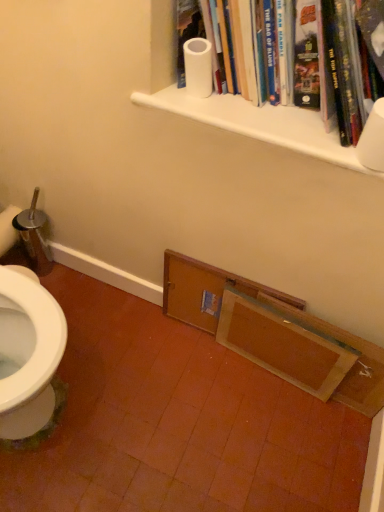
Question: From the image's perspective, is white matte shelf at upper center, placed as the first shelf when sorted from top to bottom, above white matte toilet paper at upper right, which is the second toilet paper in top-to-bottom order?

Choices:
 (A) yes
 (B) no

Answer: (A)

Question: From a real-world perspective, is white matte shelf at upper center, placed as the first shelf when sorted from top to bottom, on white matte toilet paper at upper right, which ranks as the 1th toilet paper in right-to-left order?

Choices:
 (A) no
 (B) yes

Answer: (A)

Question: Is the depth of white matte shelf at upper center, which is counted as the first shelf, starting from the front, greater than that of white matte toilet paper at upper right, the 2th toilet paper positioned from the back?

Choices:
 (A) yes
 (B) no

Answer: (A)

Question: Is white matte shelf at upper center, which is counted as the 2th shelf, starting from the back, taller than white matte toilet paper at upper right, which ranks as the second toilet paper in left-to-right order?

Choices:
 (A) yes
 (B) no

Answer: (B)

Question: From the image's perspective, would you say white matte shelf at upper center, arranged as the second shelf when ordered from the bottom, is shown under white matte toilet paper at upper right, the first toilet paper when ordered from bottom to top?

Choices:
 (A) no
 (B) yes

Answer: (A)

Question: From a real-world perspective, is wooden door at lower center, acting as the second shelf starting from the top, above or below white matte shelf at upper center, which is counted as the 2th shelf, starting from the back?

Choices:
 (A) above
 (B) below

Answer: (B)

Question: Considering the positions of wooden door at lower center, acting as the second shelf starting from the top, and white matte shelf at upper center, which is counted as the first shelf, starting from the front, in the image, is wooden door at lower center, acting as the second shelf starting from the top, bigger or smaller than white matte shelf at upper center, which is counted as the first shelf, starting from the front,?

Choices:
 (A) big
 (B) small

Answer: (A)

Question: From the image's perspective, relative to white matte shelf at upper center, which is counted as the 2th shelf, starting from the back, is wooden door at lower center, acting as the second shelf starting from the top, above or below?

Choices:
 (A) below
 (B) above

Answer: (A)

Question: Does point (208, 314) appear closer or farther from the camera than point (342, 157)?

Choices:
 (A) farther
 (B) closer

Answer: (A)

Question: Is white matte toilet paper at upper center, which is the 1th toilet paper in top-to-bottom order, bigger or smaller than white matte toilet paper at upper right, which ranks as the 1th toilet paper in right-to-left order?

Choices:
 (A) big
 (B) small

Answer: (B)

Question: Relative to white matte toilet paper at upper right, which ranks as the second toilet paper in left-to-right order, is white matte toilet paper at upper center, the second toilet paper positioned from the right, in front or behind?

Choices:
 (A) front
 (B) behind

Answer: (B)

Question: From a real-world perspective, relative to white matte toilet paper at upper right, which ranks as the 1th toilet paper in right-to-left order, is white matte toilet paper at upper center, which is the 1th toilet paper in top-to-bottom order, vertically above or below?

Choices:
 (A) below
 (B) above

Answer: (B)

Question: From the image's perspective, is white matte toilet paper at upper center, the 1th toilet paper viewed from the left, above or below white matte toilet paper at upper right, the first toilet paper when ordered from front to back?

Choices:
 (A) below
 (B) above

Answer: (B)

Question: From a real-world perspective, is white matte toilet paper at upper right, the first toilet paper when ordered from bottom to top, above or below white matte toilet paper at upper center, the 2th toilet paper when ordered from bottom to top?

Choices:
 (A) below
 (B) above

Answer: (A)

Question: Choose the correct answer: Is white matte toilet paper at upper right, which ranks as the second toilet paper in left-to-right order, inside white matte toilet paper at upper center, the 2th toilet paper when ordered from bottom to top, or outside it?

Choices:
 (A) inside
 (B) outside

Answer: (B)